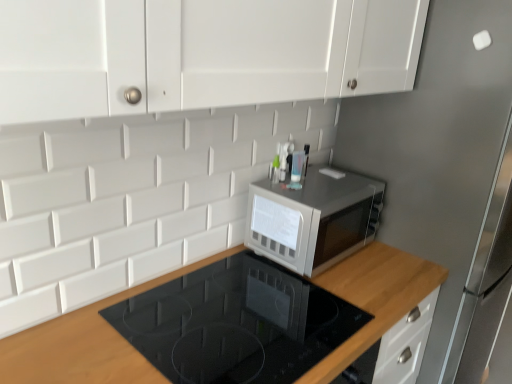
Question: Based on their sizes in the image, would you say satin silver microwave at center is bigger or smaller than wooden at upper right?

Choices:
 (A) small
 (B) big

Answer: (A)

Question: In terms of height, does satin silver microwave at center look taller or shorter compared to wooden at upper right?

Choices:
 (A) tall
 (B) short

Answer: (B)

Question: Estimate the real-world distances between objects in this image. Which object is farther from the satin silver microwave at center?

Choices:
 (A) satin silver fridge at upper right
 (B) wooden at upper right

Answer: (A)

Question: Which of these objects is positioned closest to the satin silver fridge at upper right?

Choices:
 (A) wooden at upper right
 (B) satin silver microwave at center

Answer: (B)